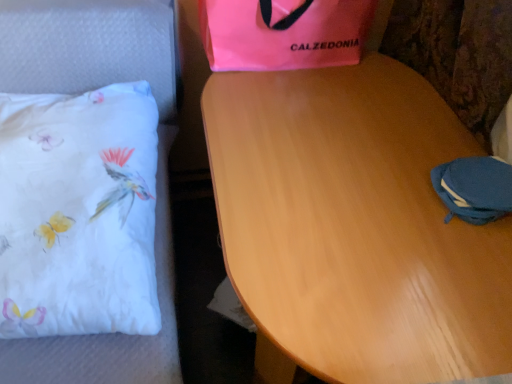
Question: From the image's perspective, is light brown wood table at center over white fabric pillow at left?

Choices:
 (A) yes
 (B) no

Answer: (B)

Question: Is light brown wood table at center positioned with its back to white fabric pillow at left?

Choices:
 (A) no
 (B) yes

Answer: (A)

Question: From a real-world perspective, is light brown wood table at center below white fabric pillow at left?

Choices:
 (A) no
 (B) yes

Answer: (B)

Question: Can you confirm if light brown wood table at center is shorter than white fabric pillow at left?

Choices:
 (A) no
 (B) yes

Answer: (A)

Question: Can you confirm if light brown wood table at center is thinner than white fabric pillow at left?

Choices:
 (A) yes
 (B) no

Answer: (B)

Question: Considering the positions of light brown wood table at center and white fabric pillow at left in the image, is light brown wood table at center taller or shorter than white fabric pillow at left?

Choices:
 (A) tall
 (B) short

Answer: (A)

Question: Would you say light brown wood table at center is to the left or to the right of white fabric pillow at left in the picture?

Choices:
 (A) left
 (B) right

Answer: (B)

Question: Is light brown wood table at center bigger or smaller than white fabric pillow at left?

Choices:
 (A) small
 (B) big

Answer: (B)

Question: Is light brown wood table at center spatially inside white fabric pillow at left, or outside of it?

Choices:
 (A) inside
 (B) outside

Answer: (B)

Question: Is light brown wood table at center to the left or to the right of blue fabric pouch at lower right in the image?

Choices:
 (A) right
 (B) left

Answer: (B)

Question: Considering their positions, is light brown wood table at center located in front of or behind blue fabric pouch at lower right?

Choices:
 (A) front
 (B) behind

Answer: (A)

Question: Is light brown wood table at center situated inside blue fabric pouch at lower right or outside?

Choices:
 (A) outside
 (B) inside

Answer: (A)

Question: Is light brown wood table at center taller or shorter than blue fabric pouch at lower right?

Choices:
 (A) short
 (B) tall

Answer: (B)

Question: Is blue fabric pouch at lower right wider or thinner than light brown wood table at center?

Choices:
 (A) wide
 (B) thin

Answer: (B)

Question: From the image's perspective, is blue fabric pouch at lower right located above or below light brown wood table at center?

Choices:
 (A) above
 (B) below

Answer: (A)